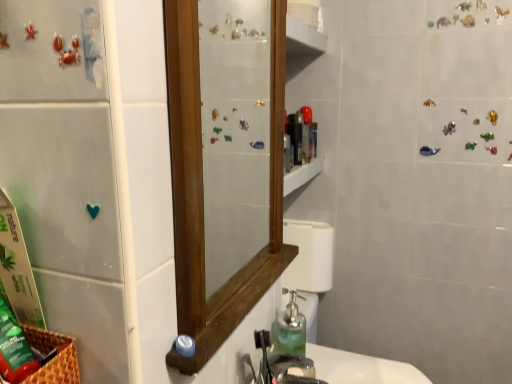
Where is `translucent plastic container at upper center`? Image resolution: width=512 pixels, height=384 pixels. translucent plastic container at upper center is located at coordinates (307, 134).

The width and height of the screenshot is (512, 384). Find the location of `white glossy sink at lower center, the 2th sink from the front`. white glossy sink at lower center, the 2th sink from the front is located at coordinates (316, 310).

The height and width of the screenshot is (384, 512). In order to click on metallic silver faucet at sink center in this screenshot , I will do `click(287, 369)`.

The image size is (512, 384). In order to click on wooden mirror at center in this screenshot , I will do `click(225, 163)`.

At what (x,y) coordinates should I click in order to perform the action: click on white glossy sink at lower center, the 1th sink positioned from the front. Please return your answer as a coordinate pair (x, y). Looking at the image, I should click on (331, 367).

Considering the relative sizes of metallic silver faucet at sink center and translucent glass soap dispenser at lower center in the image provided, is metallic silver faucet at sink center taller than translucent glass soap dispenser at lower center?

In fact, metallic silver faucet at sink center may be shorter than translucent glass soap dispenser at lower center.

Is metallic silver faucet at sink center located outside translucent glass soap dispenser at lower center?

metallic silver faucet at sink center is positioned outside translucent glass soap dispenser at lower center.

Which point is more distant from viewer, (336, 349) or (304, 141)?

The point (336, 349) is farther.

From their relative heights in the image, would you say white glossy sink at lower center, the 1th sink positioned from the front, is taller or shorter than translucent plastic container at upper center?

white glossy sink at lower center, the 1th sink positioned from the front, is shorter than translucent plastic container at upper center.

Measure the distance from white glossy sink at lower center, the 1th sink positioned from the front, to translucent plastic container at upper center.

They are 63.44 centimeters apart.

Is white glossy sink at lower center, the 1th sink positioned from the front, looking in the opposite direction of translucent plastic container at upper center?

white glossy sink at lower center, the 1th sink positioned from the front, is not turned away from translucent plastic container at upper center.

From a real-world perspective, which is physically above, translucent plastic container at upper center or white glossy sink at lower center, the 2th sink positioned from the back?

In real-world perspective, translucent plastic container at upper center is above.

From the image's perspective, is translucent plastic container at upper center on top of white glossy sink at lower center, the 1th sink positioned from the front?

Yes, from the image's perspective, translucent plastic container at upper center is above white glossy sink at lower center, the 1th sink positioned from the front.

Is translucent plastic container at upper center oriented away from white glossy sink at lower center, the 1th sink positioned from the front?

No, white glossy sink at lower center, the 1th sink positioned from the front, is not at the back of translucent plastic container at upper center.

Can you confirm if translucent plastic container at upper center is bigger than white glossy sink at lower center, the 2th sink positioned from the back?

Actually, translucent plastic container at upper center might be smaller than white glossy sink at lower center, the 2th sink positioned from the back.

Is translucent plastic container at upper center bigger than translucent glass soap dispenser at lower center?

Actually, translucent plastic container at upper center might be smaller than translucent glass soap dispenser at lower center.

Would you say translucent plastic container at upper center is inside or outside translucent glass soap dispenser at lower center?

The correct answer is: outside.

Which object is closer to the camera, translucent plastic container at upper center or translucent glass soap dispenser at lower center?

translucent glass soap dispenser at lower center is more forward.

At what (x,y) coordinates should I click in order to perform the action: click on mirror that is above the white glossy sink at lower center, which is the first sink in back-to-front order (from a real-world perspective). Please return your answer as a coordinate pair (x, y). Looking at the image, I should click on (225, 163).

Is wooden mirror at center looking in the opposite direction of white glossy sink at lower center, the 2th sink from the front?

No, white glossy sink at lower center, the 2th sink from the front, is not at the back of wooden mirror at center.

From the image's perspective, which one is positioned higher, wooden mirror at center or white glossy sink at lower center, the 2th sink from the front?

From the image's view, wooden mirror at center is above.

Is translucent plastic container at upper center not inside metallic silver faucet at sink center?

That's correct, translucent plastic container at upper center is outside of metallic silver faucet at sink center.

Is metallic silver faucet at sink center at the back of translucent plastic container at upper center?

translucent plastic container at upper center is not turned away from metallic silver faucet at sink center.

Between translucent plastic container at upper center and metallic silver faucet at sink center, which one has smaller width?

Thinner between the two is translucent plastic container at upper center.

Does translucent glass soap dispenser at lower center contain translucent plastic container at upper center?

No, translucent plastic container at upper center is not inside translucent glass soap dispenser at lower center.

Is translucent glass soap dispenser at lower center oriented towards translucent plastic container at upper center?

No, translucent glass soap dispenser at lower center is not oriented towards translucent plastic container at upper center.

Is translucent glass soap dispenser at lower center taller than translucent plastic container at upper center?

Incorrect, the height of translucent glass soap dispenser at lower center is not larger of that of translucent plastic container at upper center.

From the image's perspective, is translucent glass soap dispenser at lower center over translucent plastic container at upper center?

Actually, translucent glass soap dispenser at lower center appears below translucent plastic container at upper center in the image.

This screenshot has height=384, width=512. I want to click on soap dispenser behind the metallic silver faucet at sink center, so click(x=289, y=330).

Which sink is the 2nd one when counting from the front of the translucent plastic container at upper center? Please provide its 2D coordinates.

[(331, 367)]

Considering their positions, is white glossy sink at lower center, the 2th sink from the front, positioned further to white glossy sink at lower center, the 1th sink positioned from the front, than wooden mirror at center?

wooden mirror at center lies further to white glossy sink at lower center, the 1th sink positioned from the front, than the other object.

Estimate the real-world distances between objects in this image. Which object is further from translucent plastic container at upper center, wooden mirror at center or translucent glass soap dispenser at lower center?

The object further to translucent plastic container at upper center is translucent glass soap dispenser at lower center.

From the image, which object appears to be nearer to white glossy sink at lower center, the 2th sink positioned from the back, wooden mirror at center or metallic silver faucet at sink center?

Based on the image, metallic silver faucet at sink center appears to be nearer to white glossy sink at lower center, the 2th sink positioned from the back.

Looking at the image, which one is located further to white glossy sink at lower center, the 2th sink positioned from the back, metallic silver faucet at sink center or translucent plastic container at upper center?

translucent plastic container at upper center.

Considering their positions, is wooden mirror at center positioned further to white glossy sink at lower center, the 2th sink from the front, than translucent glass soap dispenser at lower center?

translucent glass soap dispenser at lower center.

Estimate the real-world distances between objects in this image. Which object is closer to white glossy sink at lower center, the 2th sink positioned from the back, wooden mirror at center or white glossy sink at lower center, the 2th sink from the front?

white glossy sink at lower center, the 2th sink from the front, lies closer to white glossy sink at lower center, the 2th sink positioned from the back, than the other object.

Which object lies nearer to the anchor point wooden mirror at center, white glossy sink at lower center, which is the first sink in back-to-front order, or metallic silver faucet at sink center?

white glossy sink at lower center, which is the first sink in back-to-front order, is closer to wooden mirror at center.

Estimate the real-world distances between objects in this image. Which object is further from white glossy sink at lower center, the 1th sink positioned from the front, translucent glass soap dispenser at lower center or white glossy sink at lower center, which is the first sink in back-to-front order?

Based on the image, white glossy sink at lower center, which is the first sink in back-to-front order, appears to be further to white glossy sink at lower center, the 1th sink positioned from the front.

This screenshot has width=512, height=384. I want to click on soap dispenser between translucent plastic container at upper center and white glossy sink at lower center, the 2th sink positioned from the back, in the vertical direction, so click(289, 330).

The width and height of the screenshot is (512, 384). I want to click on sink that lies between wooden mirror at center and white glossy sink at lower center, the 2th sink from the front, from top to bottom, so click(x=331, y=367).

Find the location of a particular element. This screenshot has height=384, width=512. soap dispenser that lies between wooden mirror at center and white glossy sink at lower center, the 2th sink positioned from the back, from top to bottom is located at coordinates (289, 330).

Find the location of `soap dispenser between metallic silver faucet at sink center and translucent plastic container at upper center along the z-axis`. soap dispenser between metallic silver faucet at sink center and translucent plastic container at upper center along the z-axis is located at coordinates (289, 330).